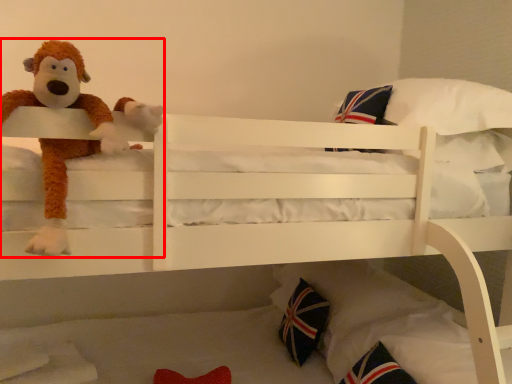
Question: Considering the relative positions of toy (annotated by the red box) and throw pillow in the image provided, where is toy (annotated by the red box) located with respect to the staircase?

Choices:
 (A) left
 (B) right

Answer: (A)